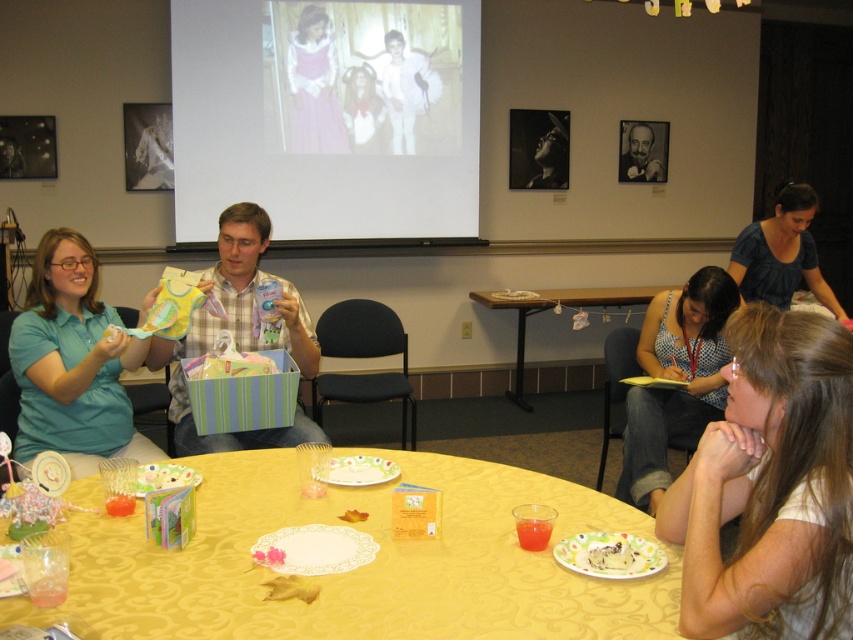
Which is below, white matte projection screen at upper center or matte teal shirt at left?

matte teal shirt at left

Image resolution: width=853 pixels, height=640 pixels. Describe the element at coordinates (328, 115) in the screenshot. I see `white matte projection screen at upper center` at that location.

Between point (412, 216) and point (20, 420), which one is positioned behind?

Positioned behind is point (412, 216).

Where is `white matte projection screen at upper center`? The image size is (853, 640). white matte projection screen at upper center is located at coordinates (328, 115).

You are a GUI agent. You are given a task and a screenshot of the screen. Output one action in this format:
    pyautogui.click(x=<x>, y=<y>)
    Task: Click on the matte teal shirt at left
    This screenshot has width=853, height=640.
    Given the screenshot: What is the action you would take?
    pyautogui.click(x=73, y=364)

Looking at this image, who is taller, matte teal shirt at left or blue cotton shirt at upper right?

matte teal shirt at left is taller.

Image resolution: width=853 pixels, height=640 pixels. I want to click on matte teal shirt at left, so click(73, 364).

Image resolution: width=853 pixels, height=640 pixels. I want to click on matte teal shirt at left, so click(x=73, y=364).

Is matte plastic gift bag at upper left below plaid shirt at center?

Yes.

Can you confirm if matte plastic gift bag at upper left is thinner than plaid shirt at center?

In fact, matte plastic gift bag at upper left might be wider than plaid shirt at center.

The width and height of the screenshot is (853, 640). Describe the element at coordinates (364, 564) in the screenshot. I see `matte plastic gift bag at upper left` at that location.

In order to click on matte plastic gift bag at upper left in this screenshot , I will do pos(364,564).